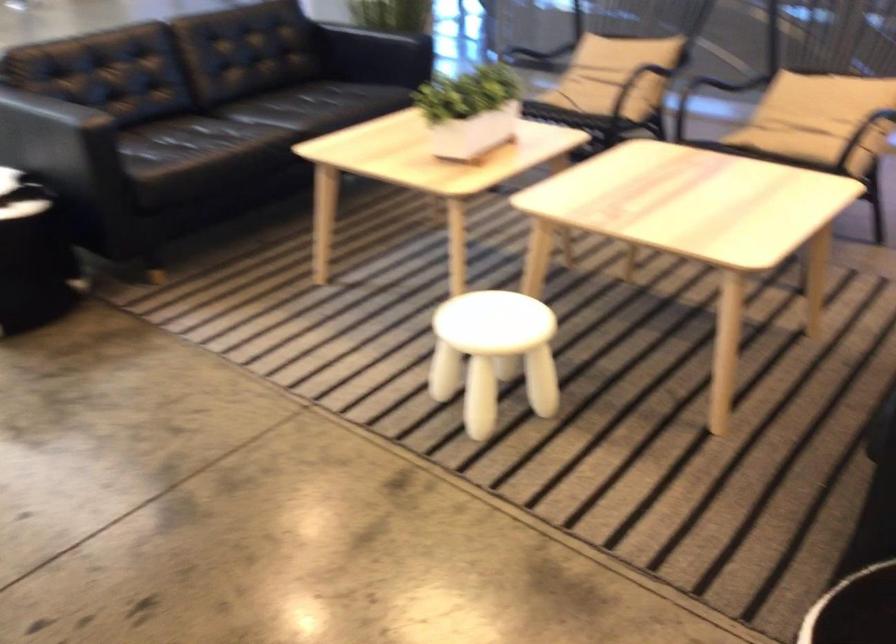
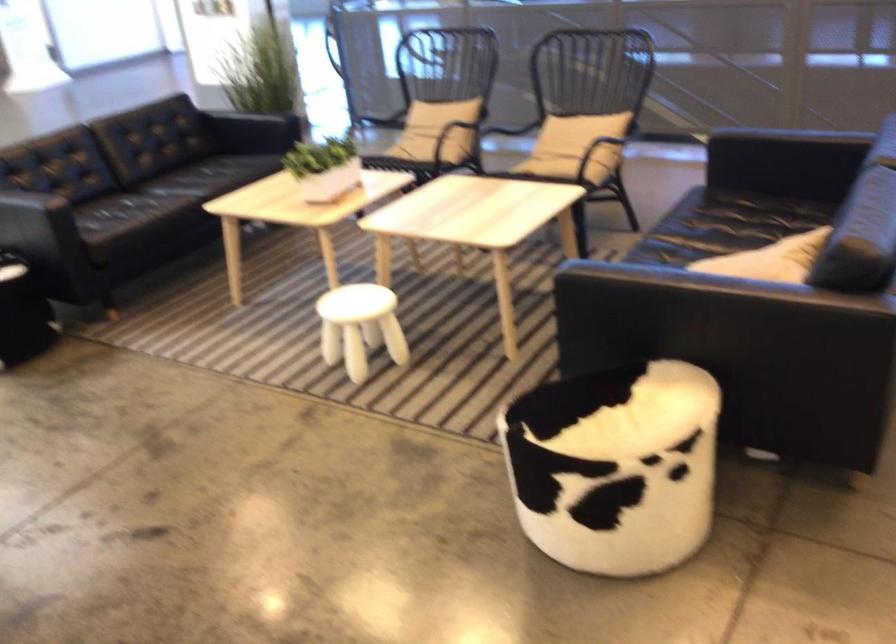
The point at [797,137] is marked in the first image. Where is the corresponding point in the second image?

(552, 160)